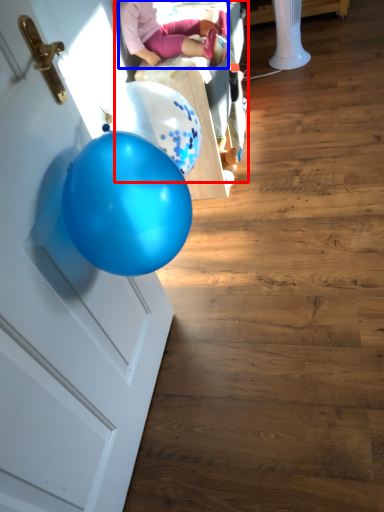
Question: Which object appears closest to the camera in this image, baby carriage (highlighted by a red box) or person (highlighted by a blue box)?

Choices:
 (A) baby carriage
 (B) person

Answer: (B)